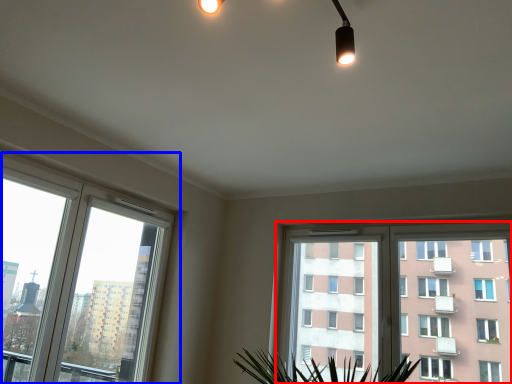
Question: Which object appears closest to the camera in this image, window (highlighted by a red box) or window (highlighted by a blue box)?

Choices:
 (A) window
 (B) window

Answer: (B)